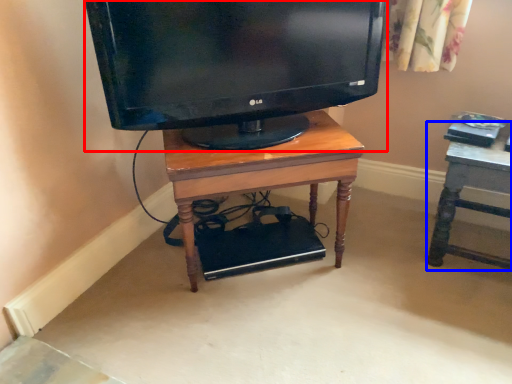
Question: Which of the following is the farthest to the observer, television (highlighted by a red box) or furniture (highlighted by a blue box)?

Choices:
 (A) television
 (B) furniture

Answer: (B)